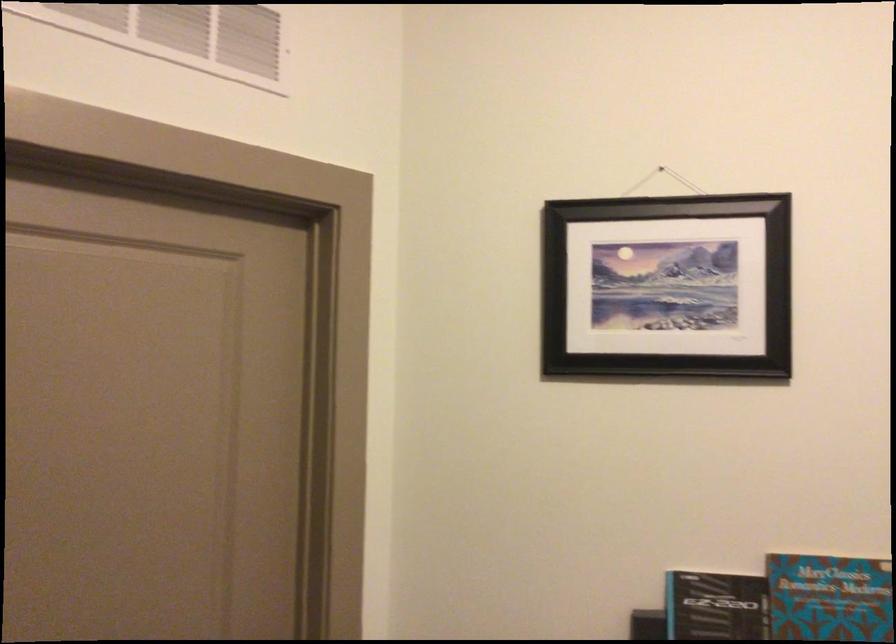
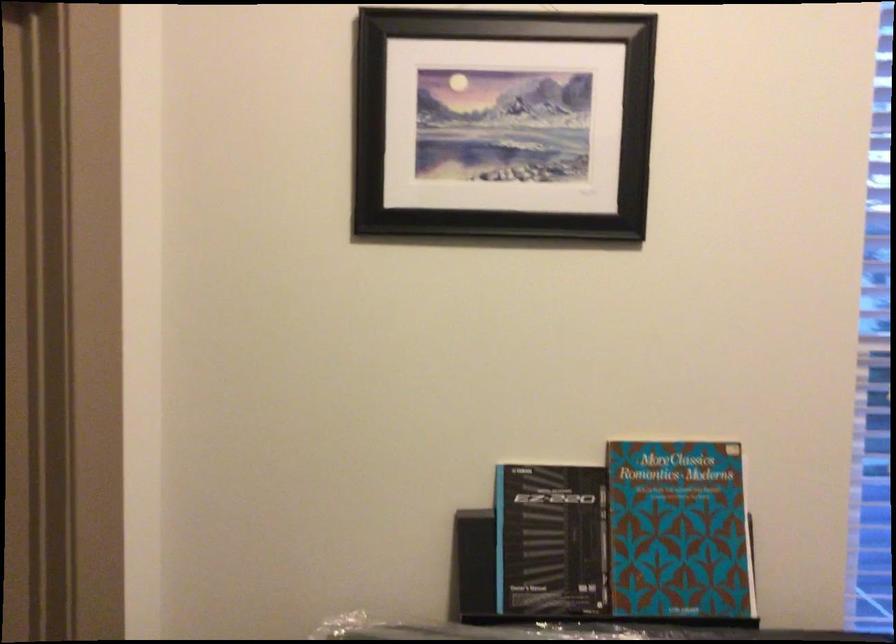
Question: Which direction would the cameraman need to move to produce the second image? Reply with the corresponding letter.

Choices:
 (A) Left
 (B) Right
 (C) Forward
 (D) Backward

Answer: (C)